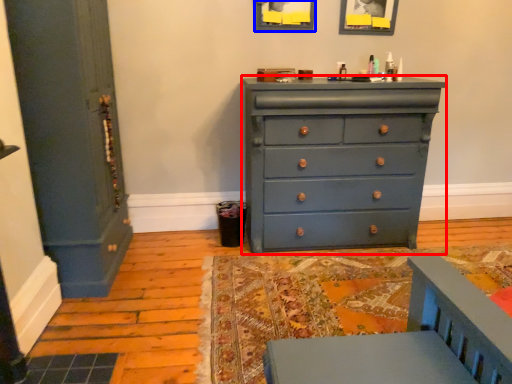
Question: Which of the following is the closest to the observer, chest of drawers (highlighted by a red box) or picture frame (highlighted by a blue box)?

Choices:
 (A) chest of drawers
 (B) picture frame

Answer: (A)